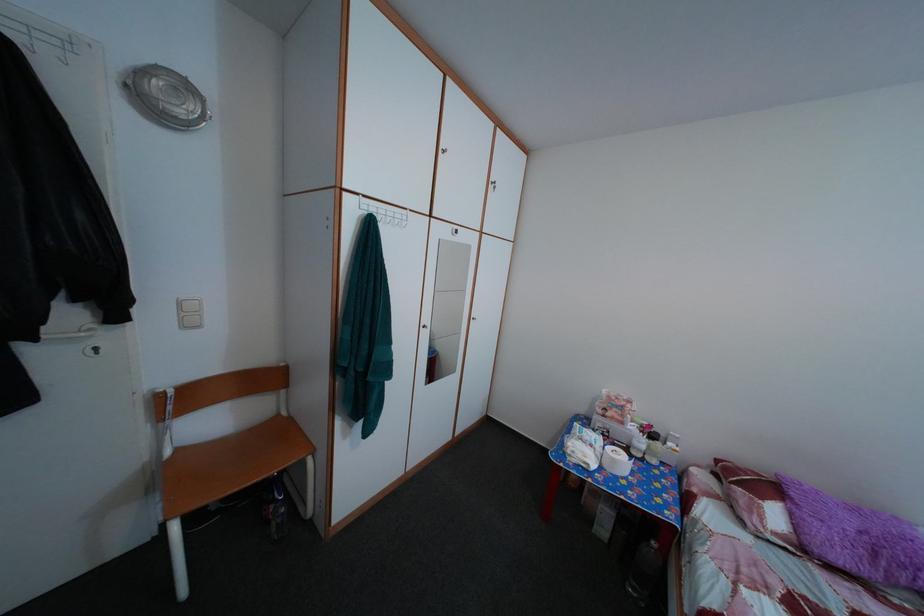
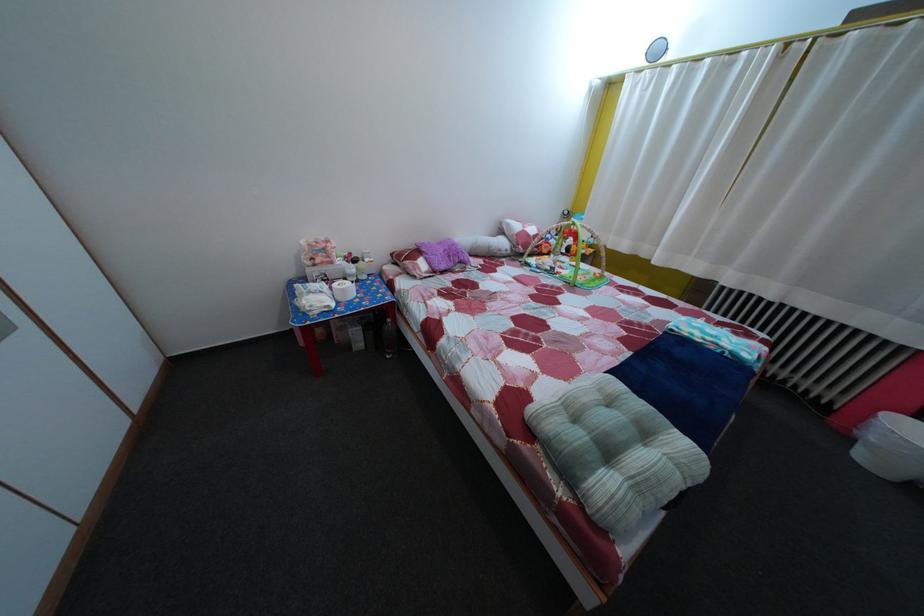
Find the pixel in the second image that matches pixel 864 517 in the first image.

(450, 252)